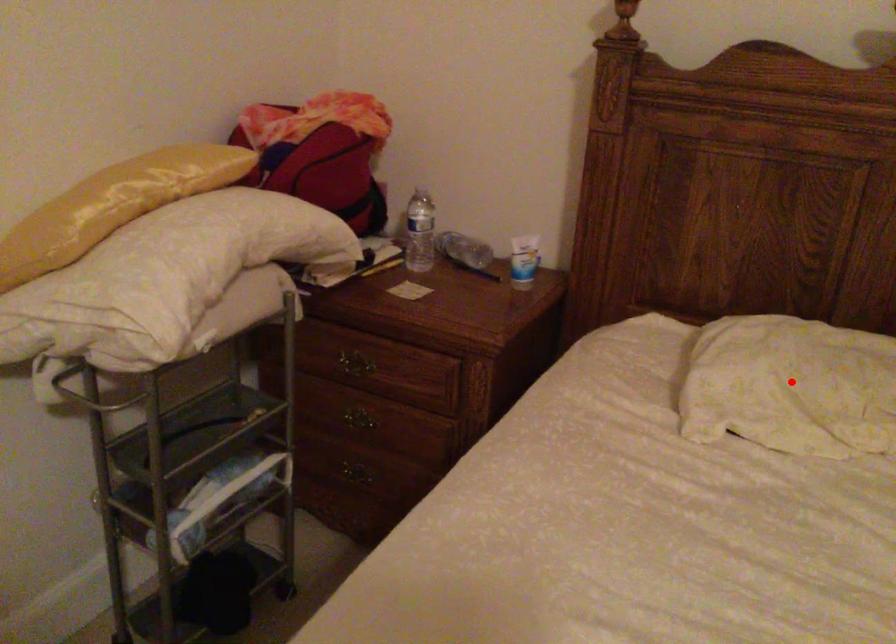
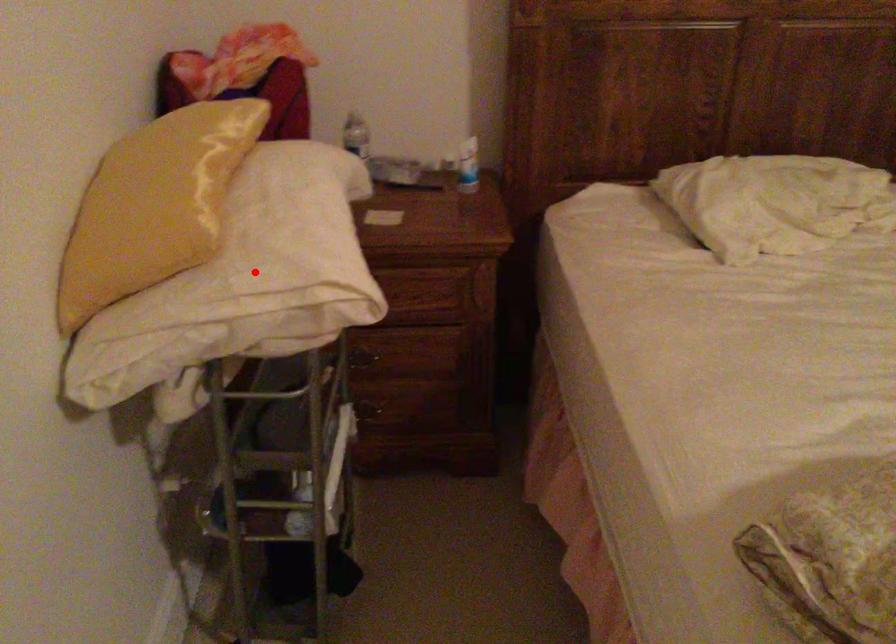
I am providing you with two images of the same scene from different viewpoints. A red point is marked on the first image and another point is marked on the second image. Do the highlighted points in image1 and image2 indicate the same real-world spot?

No